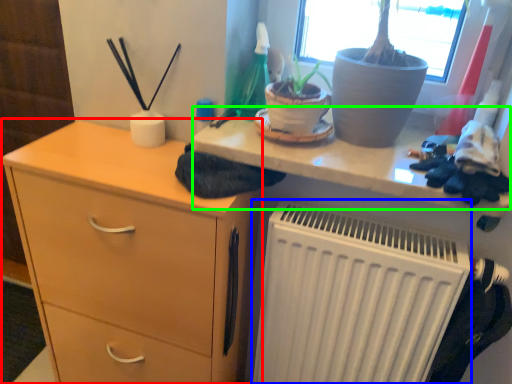
Question: Which is farther away from chest of drawers (highlighted by a red box)? radiator (highlighted by a blue box) or writing desk (highlighted by a green box)?

Choices:
 (A) radiator
 (B) writing desk

Answer: (B)